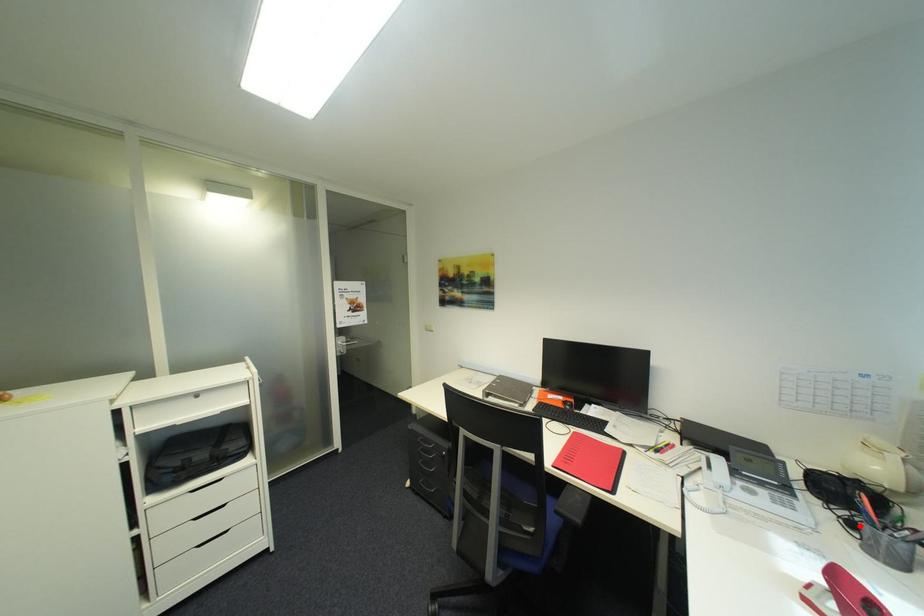
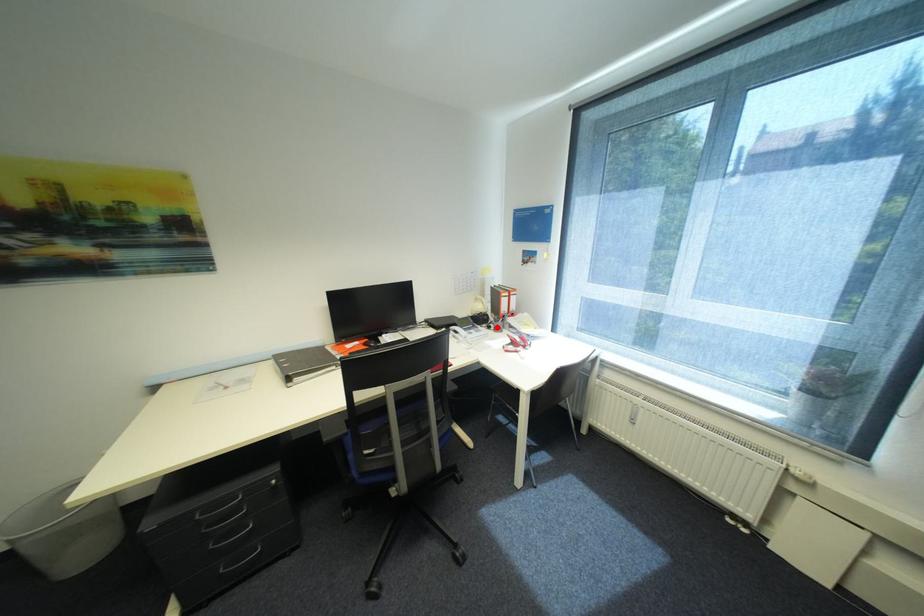
I am providing you with two images of the same scene from different viewpoints. A red point is marked on the first image and another point is marked on the second image. Do the highlighted points in image1 and image2 indicate the same real-world spot?

Yes